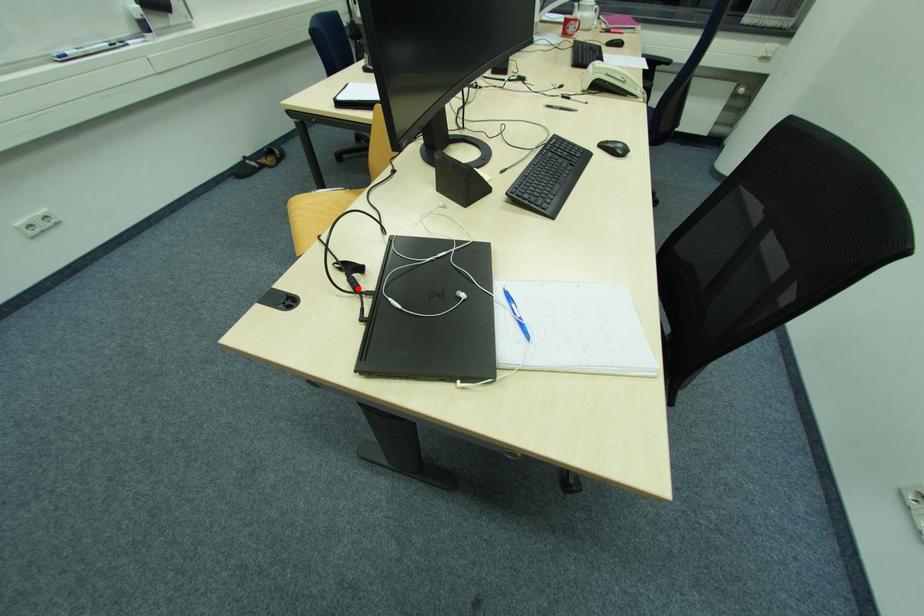
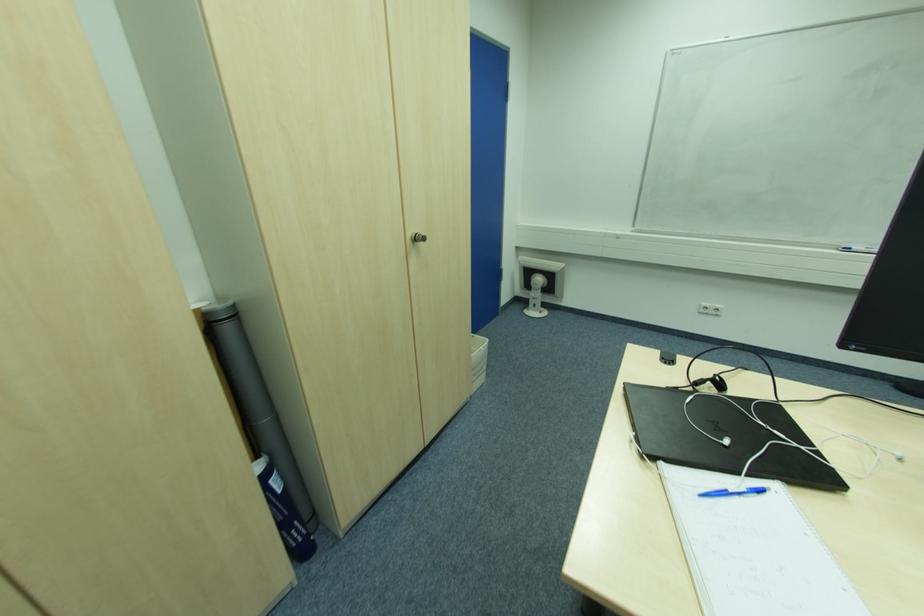
Where in the second image is the point corresponding to the highlighted location from the first image?

(699, 385)